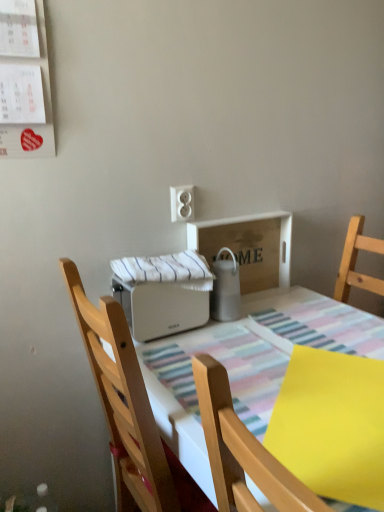
At what (x,y) coordinates should I click in order to perform the action: click on free space to the right of satin silver thermos at center, arranged as the first appliance when viewed from the right. Please return your answer as a coordinate pair (x, y). Image resolution: width=384 pixels, height=512 pixels. Looking at the image, I should click on (273, 317).